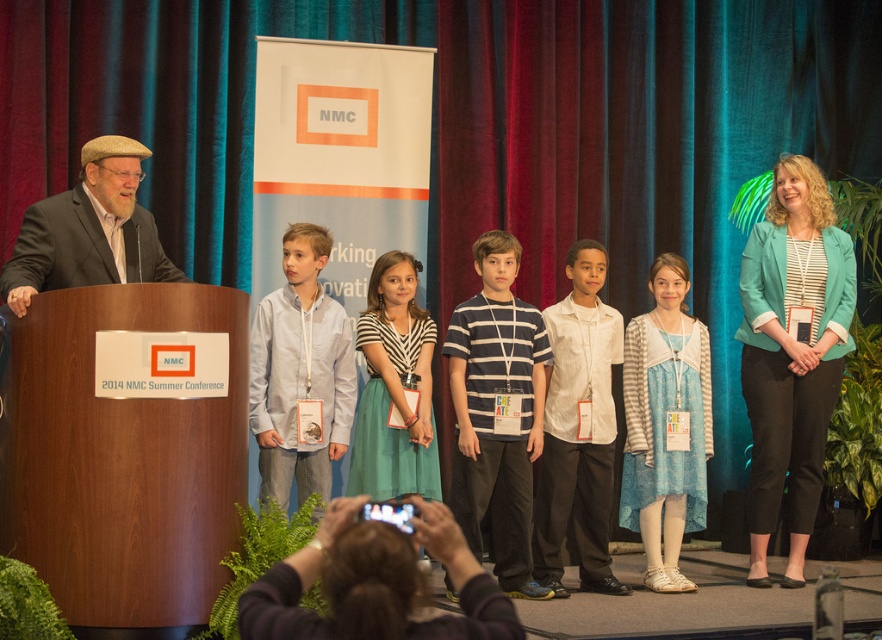
Is point (285, 580) farther from viewer compared to point (596, 497)?

No, (285, 580) is in front of (596, 497).

Is point (372, 605) positioned in front of point (582, 579)?

Yes, it is.

Where is `black fabric camera at lower center`? The height and width of the screenshot is (640, 882). black fabric camera at lower center is located at coordinates (374, 582).

Does striped cotton shirt at center have a smaller size compared to black fabric camera at lower center?

No, striped cotton shirt at center is not smaller than black fabric camera at lower center.

Which is behind, point (497, 372) or point (460, 560)?

The point (497, 372) is behind.

Image resolution: width=882 pixels, height=640 pixels. What do you see at coordinates (497, 412) in the screenshot?
I see `striped cotton shirt at center` at bounding box center [497, 412].

Where is `striped cotton shirt at center`? The image size is (882, 640). striped cotton shirt at center is located at coordinates (497, 412).

Measure the distance from light blue shirt at center to matte brown suit at left.

light blue shirt at center and matte brown suit at left are 4.31 feet apart.

Is point (265, 323) in front of point (72, 244)?

No, (265, 323) is behind (72, 244).

Does point (300, 250) come in front of point (43, 216)?

That is False.

Where is `light blue shirt at center`? The width and height of the screenshot is (882, 640). light blue shirt at center is located at coordinates (300, 374).